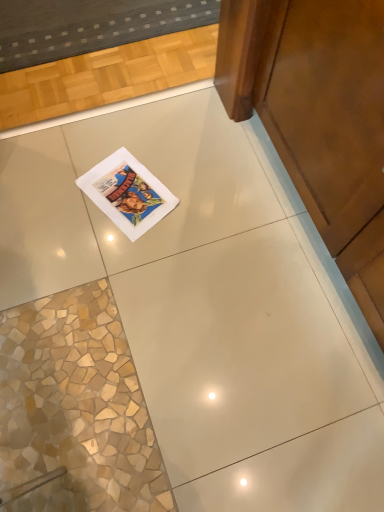
In order to click on free region on the left part of matte paper magazine at center in this screenshot , I will do `click(62, 190)`.